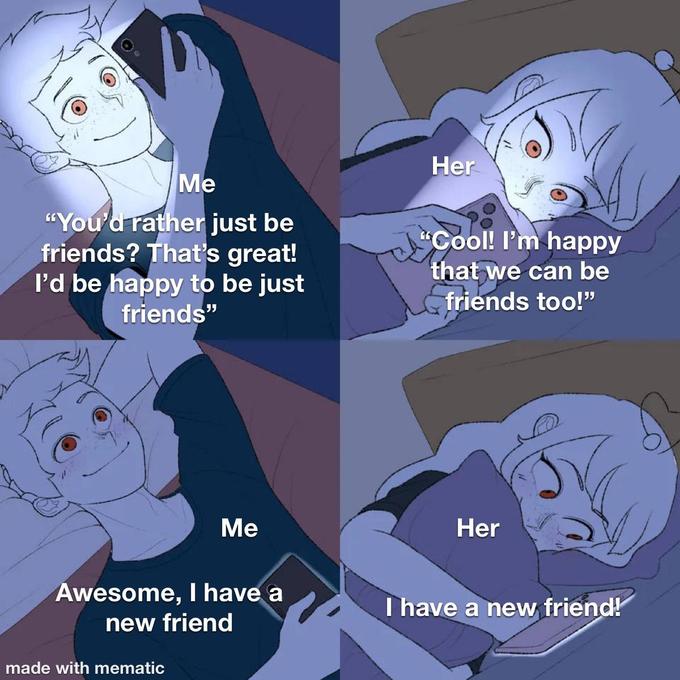
At what (x,y) coordinates should I click in order to perform the action: click on pillow. Please return your answer as a coordinate pair (x, y). This screenshot has height=680, width=680. Looking at the image, I should click on (477, 549), (15, 364), (15, 196), (647, 235), (441, 181), (649, 557).